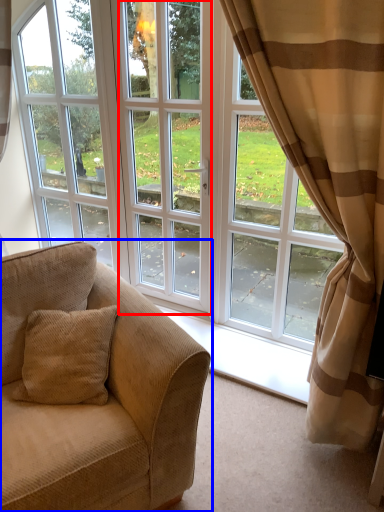
Question: Which object appears farthest to the camera in this image, screen door (highlighted by a red box) or studio couch (highlighted by a blue box)?

Choices:
 (A) screen door
 (B) studio couch

Answer: (A)